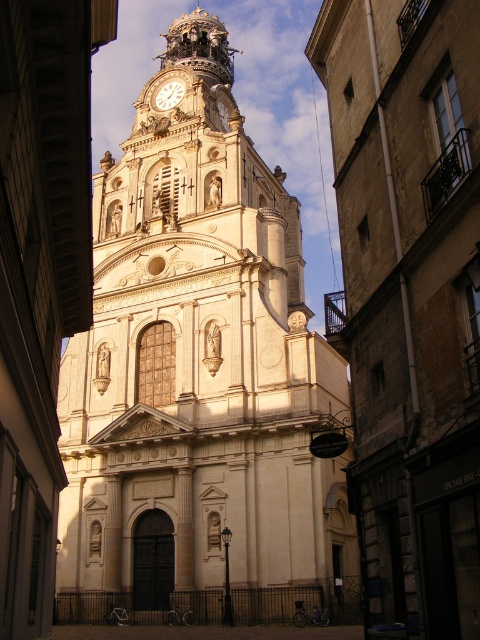
From the picture: You are standing in front of the church and want to take a photo of the gold metallic clock at upper center. To ensure the white stone church at center is also in the frame, where should you position the camera relative to the clock?

The white stone church at center is positioned on the right side of the gold metallic clock at upper center, so you should position the camera to the left of the clock to include both in the frame.

You are standing 50 meters away from the church. You want to approach the point at coordinates point (273, 596). Can you safely walk towards it without getting too close?

The point at coordinates point (273, 596) is 52.14 meters from the viewer. Since you are currently 50 meters away from the church, moving closer would bring you within 2.14 meters of the point, which may be too close depending on safety requirements.

You are a tourist standing in front of the church and want to take a photo that includes both the white stone tower at center and the white stone church at center. Which one should you focus on to ensure both are in the frame?

You should focus on the white stone church at center because the white stone tower at center is positioned over it, meaning the tower is above the church and both can be captured by framing the church as the base.